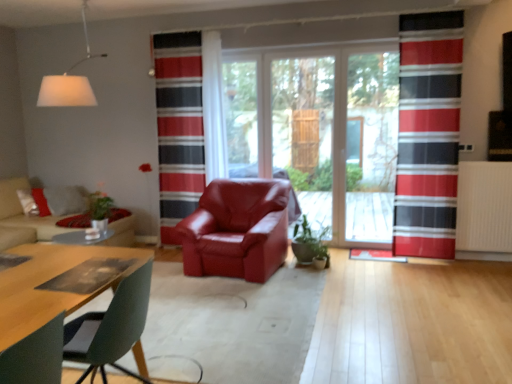
Find the location of a particular element. The width and height of the screenshot is (512, 384). free point above white textured radiator at right (from a real-world perspective) is located at coordinates (490, 160).